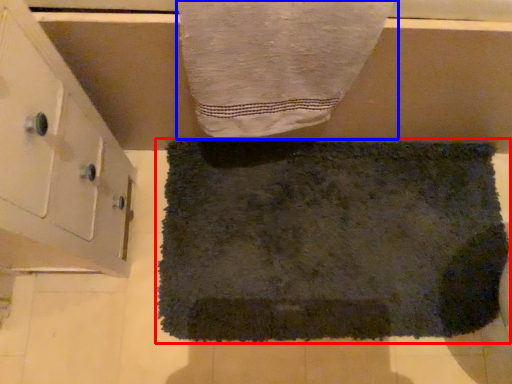
Question: Which object is further to the camera taking this photo, towel (highlighted by a red box) or towel (highlighted by a blue box)?

Choices:
 (A) towel
 (B) towel

Answer: (A)